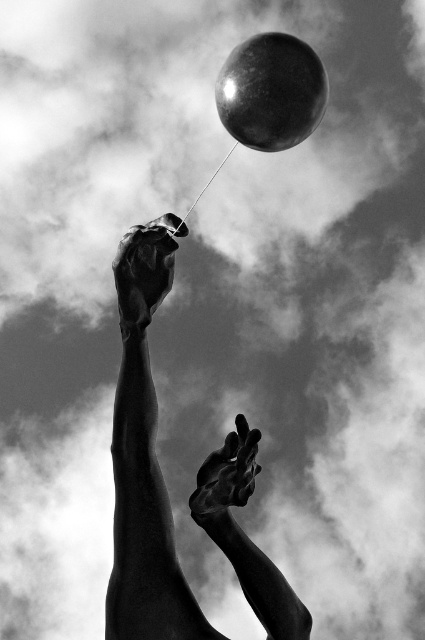
Question: Does polished bronze hand at upper center appear over shiny metallic hand at center?

Choices:
 (A) yes
 (B) no

Answer: (A)

Question: Can you confirm if polished bronze hand at upper center is positioned below shiny metallic hand at center?

Choices:
 (A) yes
 (B) no

Answer: (B)

Question: Which object is closer to the camera taking this photo?

Choices:
 (A) shiny metallic hand at center
 (B) polished bronze hand at upper center
 (C) polished bronze statue hands at center
 (D) glossy metallic balloon at upper center

Answer: (C)

Question: Which point is closer to the camera?

Choices:
 (A) glossy metallic balloon at upper center
 (B) shiny metallic hand at center
 (C) polished bronze hand at upper center
 (D) polished bronze statue hands at center

Answer: (D)

Question: Which of the following is the closest to the observer?

Choices:
 (A) polished bronze hand at upper center
 (B) polished bronze statue hands at center

Answer: (B)

Question: Can you confirm if glossy metallic balloon at upper center is bigger than polished bronze hand at upper center?

Choices:
 (A) no
 (B) yes

Answer: (B)